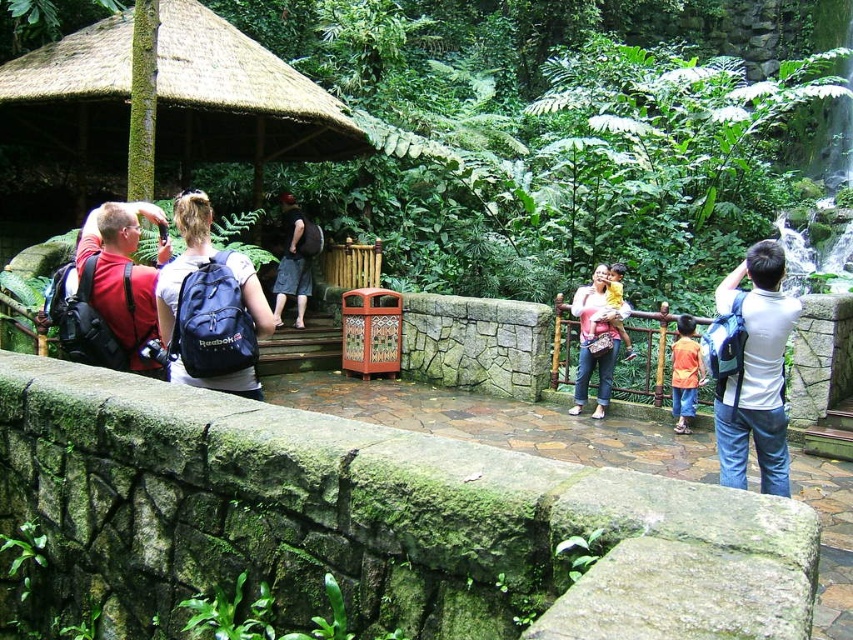
You are a hiker who wants to know if you can safely walk between the blue fabric backpack at center and the white fabric backpack at right without getting too close. The path is narrow. If the minimum safe distance you need to pass is 3 meters, can you walk through?

The distance between the blue fabric backpack at center and the white fabric backpack at right is 3.69 meters, which is greater than the 3 meters required for safe passage. Therefore, you can safely walk through the gap between them.

You are a photographer trying to capture a closeup of the green mossy stone ledge at lower left. However, the matte red backpack at left is blocking your view. Can you determine if the backpack is smaller than the ledge?

The green mossy stone ledge at lower left is larger in size than the matte red backpack at left, so yes, the backpack is smaller and might be moved to allow a clear view of the ledge.

You are a photographer trying to capture the wooden structure with the thatched roof in the background. You notice the white fabric backpack at right and the orange fabric shirt at center in your shot. Which object should you move to the side so that the wooden structure is more visible?

The white fabric backpack at right is positioned on the left side of orange fabric shirt at center. To make the wooden structure more visible, you should move the orange fabric shirt at center since it is closer to the center of the frame and blocking the view.